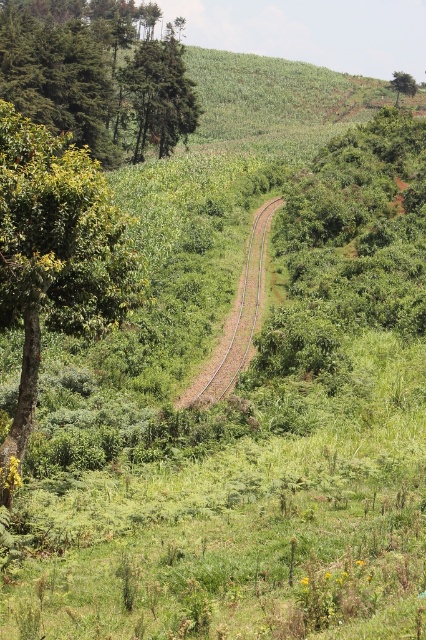
You are a photographer standing at the edge of the brown metallic train track at center, aiming to capture the green matte tree at upper left in your shot. Based on the scene, can you confirm if the tree will appear behind or in front of the train track in the photograph?

The green matte tree at upper left is above the brown metallic train track at center, so in the photograph, the tree will appear behind the train track.

You are a photographer planning to take a photo of the green matte tree at upper left and the brown metallic train track at center. Which object should you focus on first if you want both to be in sharp focus, considering their relative sizes and positions?

The green matte tree at upper left should be focused on first because it is larger in size compared to the brown metallic train track at center, ensuring that its details are captured clearly before adjusting focus for the smaller track.